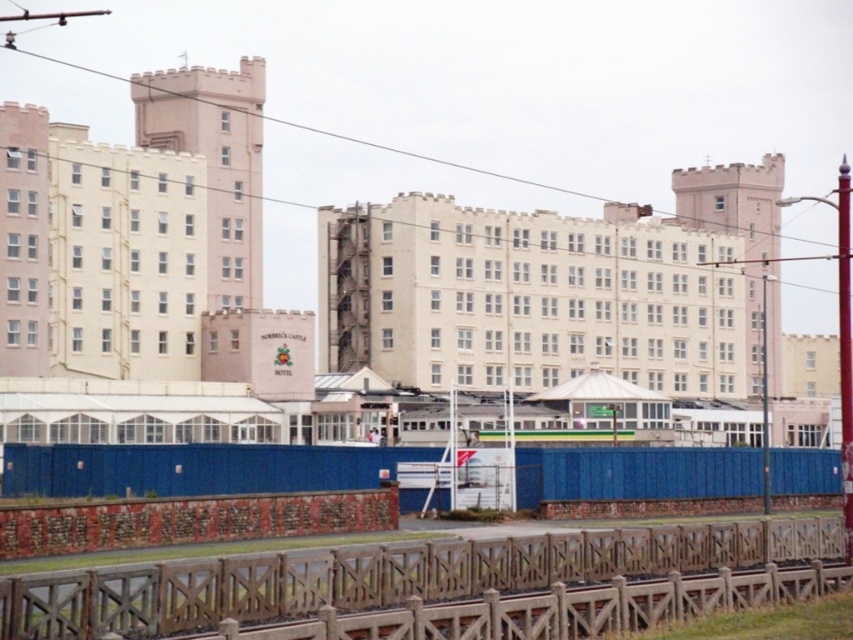
Question: Can you confirm if wooden at lower center is positioned below blue plastic fence at lower center?

Choices:
 (A) no
 (B) yes

Answer: (B)

Question: Does wooden at lower center lie in front of blue plastic fence at lower center?

Choices:
 (A) no
 (B) yes

Answer: (B)

Question: Which point is closer to the camera?

Choices:
 (A) (78, 637)
 (B) (814, 456)

Answer: (A)

Question: Can you confirm if wooden at lower center is positioned below blue plastic fence at lower center?

Choices:
 (A) no
 (B) yes

Answer: (B)

Question: Among these objects, which one is nearest to the camera?

Choices:
 (A) wooden at lower center
 (B) blue plastic fence at lower center

Answer: (A)